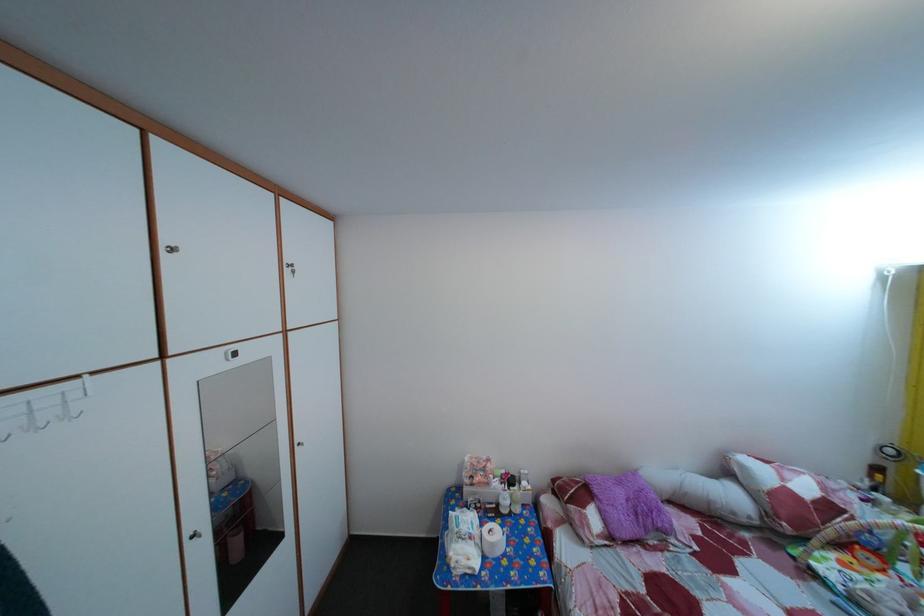
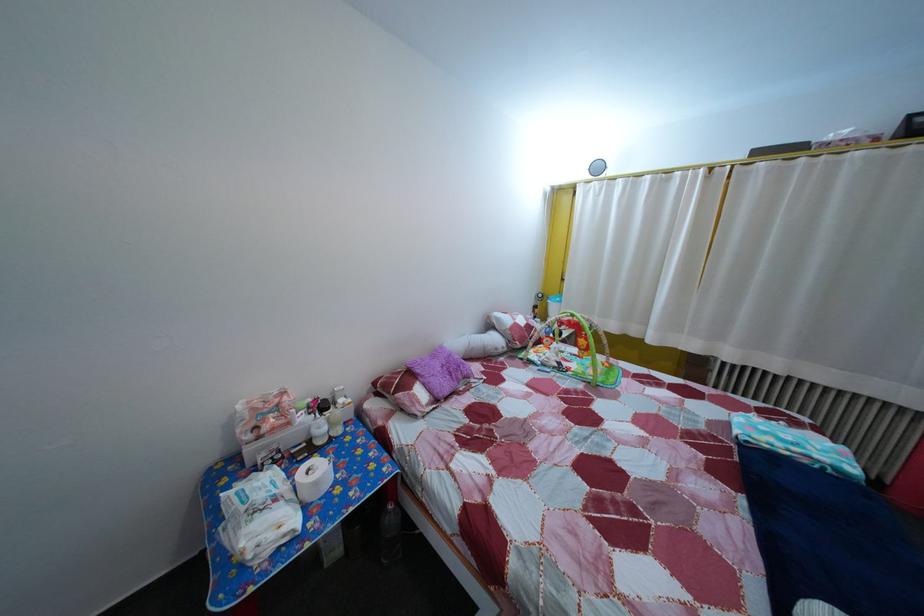
In the second image, find the point that corresponds to pixel 505 493 in the first image.

(311, 427)